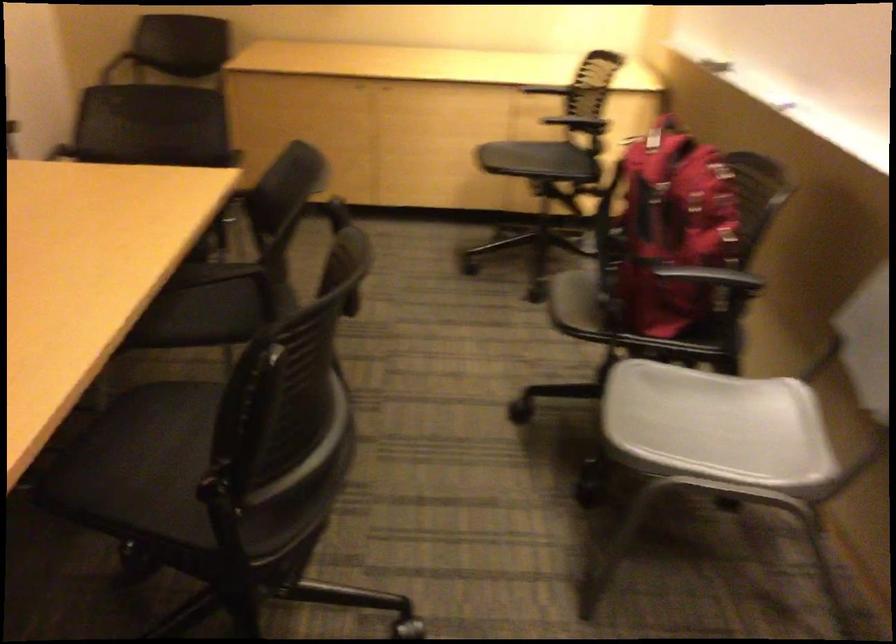
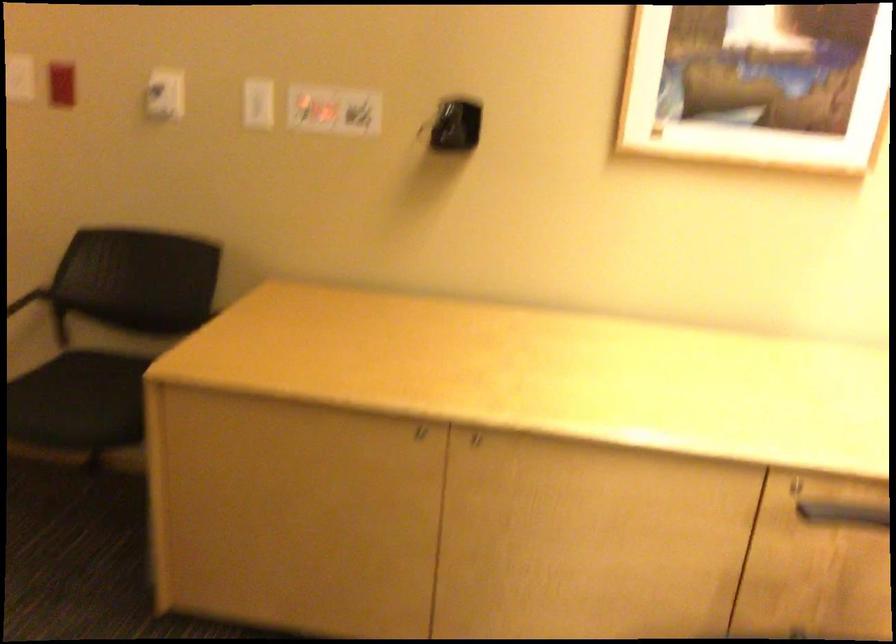
Find the pixel in the second image that matches (x=538, y=98) in the first image.

(828, 507)